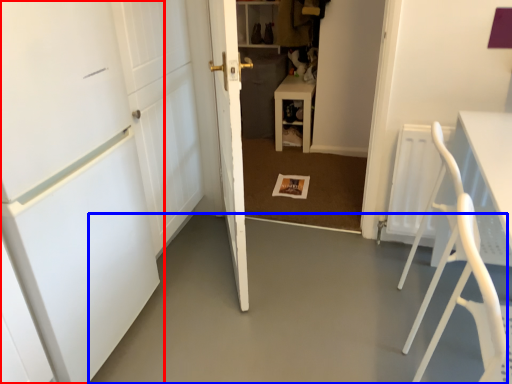
Question: Which object appears farthest to the camera in this image, door (highlighted by a red box) or concrete (highlighted by a blue box)?

Choices:
 (A) door
 (B) concrete

Answer: (B)